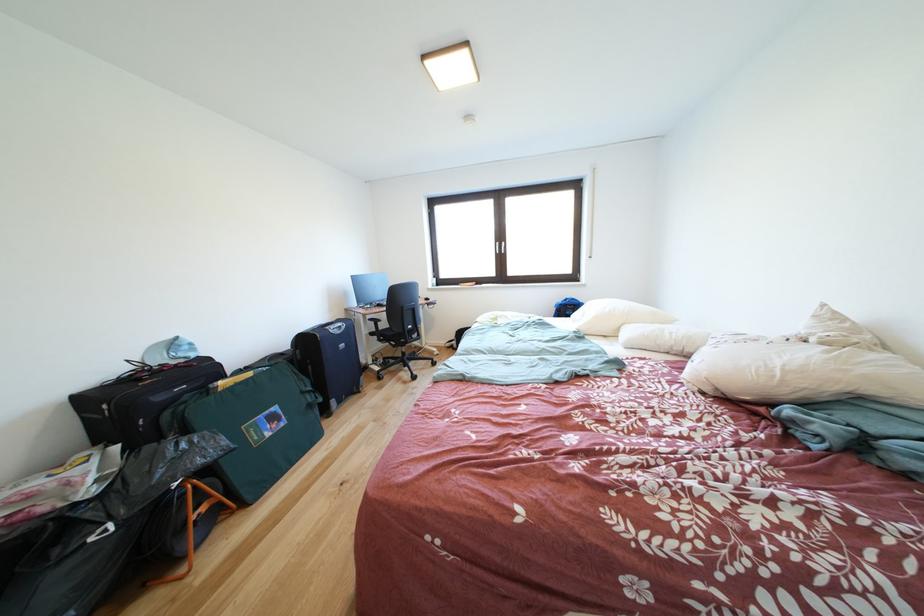
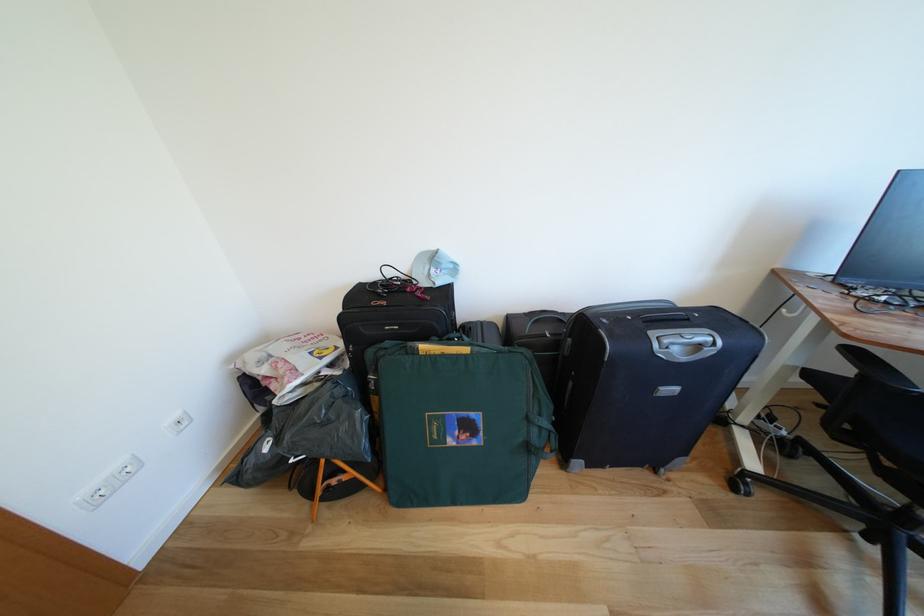
Where in the second image is the point corresponding to [180,349] from the first image?

(442, 262)